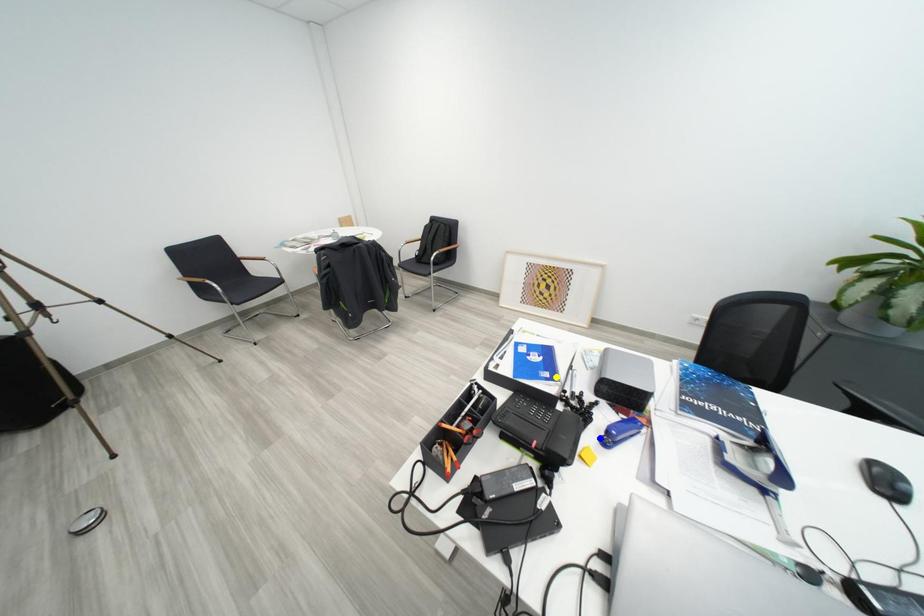
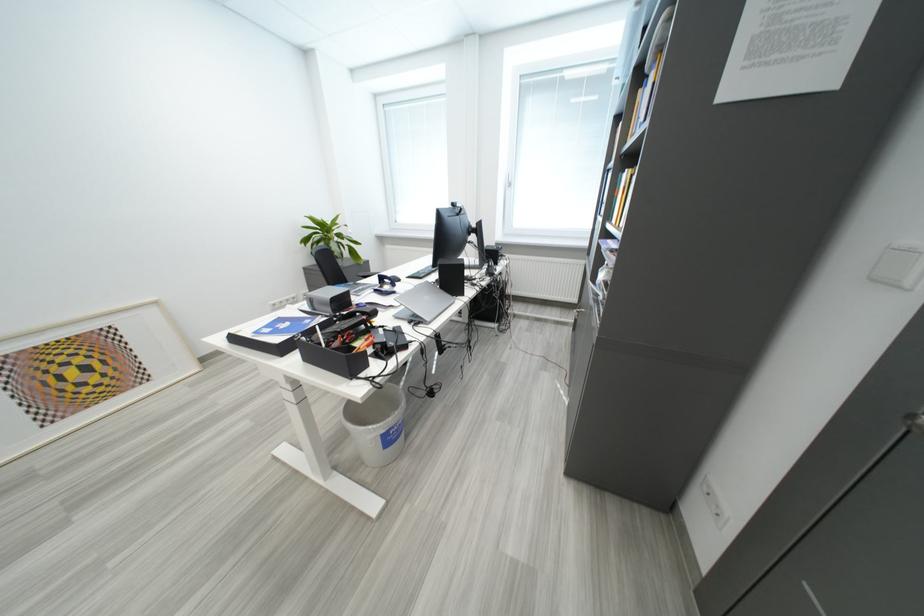
I am providing you with two images of the same scene from different viewpoints. Three points are marked in image1. Which point corresponds to a part or object that is occluded in image2?In image1, three points are marked. Which of them correspond to a part or object that is occluded in image2?Among the three points shown in image1, which one corresponds to a part or object that is no longer visible due to occlusion in image2?

Invisible in image2: green point, blue point.